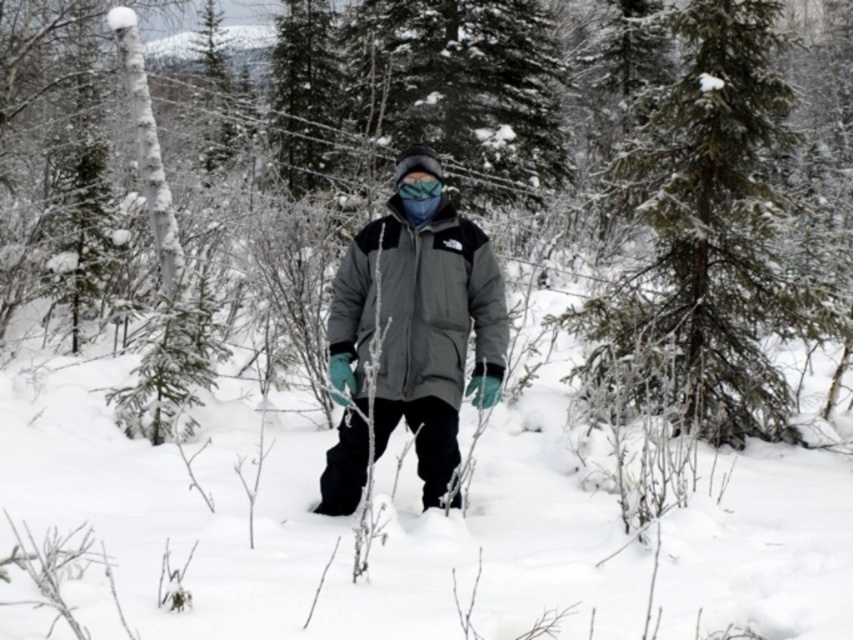
Does gray matte jacket at center have a greater height compared to blue fabric goggles at center?

Indeed, gray matte jacket at center has a greater height compared to blue fabric goggles at center.

Is point (437, 456) positioned after point (432, 184)?

Yes, it is behind point (432, 184).

Find the location of `gray matte jacket at center`. gray matte jacket at center is located at coordinates (419, 321).

Who is positioned more to the left, green textured pine tree at upper right or gray matte jacket at center?

Positioned to the left is gray matte jacket at center.

Which is in front, point (722, 326) or point (403, 288)?

Positioned in front is point (403, 288).

Locate an element on the screen. Image resolution: width=853 pixels, height=640 pixels. green textured pine tree at upper right is located at coordinates (709, 236).

Who is lower down, green textured pine tree at upper right or blue fabric goggles at center?

blue fabric goggles at center is lower down.

Is point (752, 68) behind point (431, 193)?

Yes, point (752, 68) is farther from viewer.

This screenshot has width=853, height=640. Find the location of `green textured pine tree at upper right`. green textured pine tree at upper right is located at coordinates (709, 236).